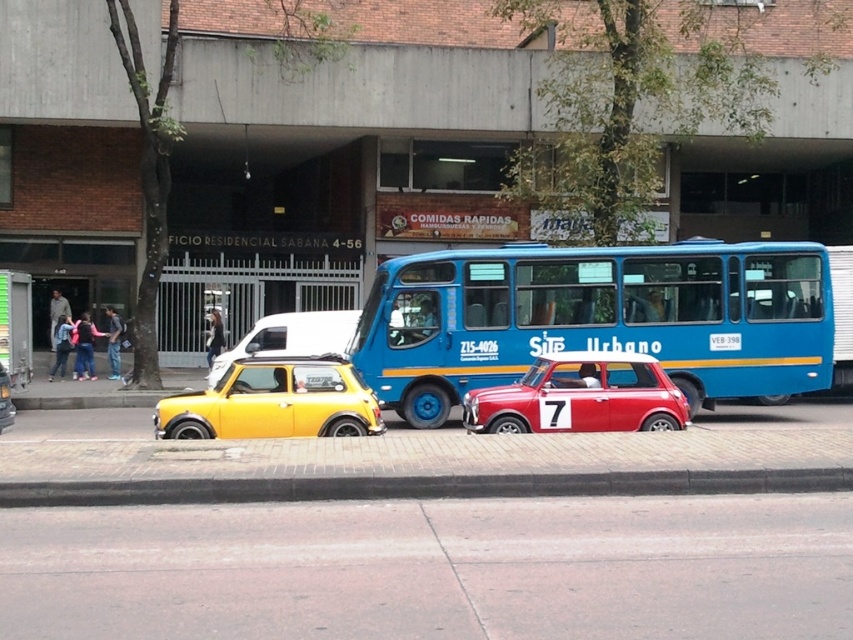
Can you confirm if shiny red car at center is positioned below yellow matte car at center?

No.

Is point (543, 426) positioned in front of point (0, 413)?

Yes.

You are a GUI agent. You are given a task and a screenshot of the screen. Output one action in this format:
    pyautogui.click(x=<x>, y=<y>)
    Task: Click on the shiny red car at center
    Image resolution: width=853 pixels, height=640 pixels.
    Given the screenshot: What is the action you would take?
    pyautogui.click(x=579, y=396)

Is blue metallic bus at center positioned behind shiny yellow car at center?

Yes.

Which of these two, blue metallic bus at center or shiny yellow car at center, stands shorter?

With less height is shiny yellow car at center.

What are the coordinates of `blue metallic bus at center` in the screenshot? It's located at (598, 317).

Does shiny red car at center have a greater height compared to yellow matte hatchback at center?

Incorrect, shiny red car at center's height is not larger of yellow matte hatchback at center's.

Is shiny red car at center closer to the viewer compared to yellow matte hatchback at center?

Yes, it is in front of yellow matte hatchback at center.

Which is in front, point (544, 372) or point (256, 330)?

Point (544, 372) is in front.

Identify the location of shiny red car at center. (579, 396).